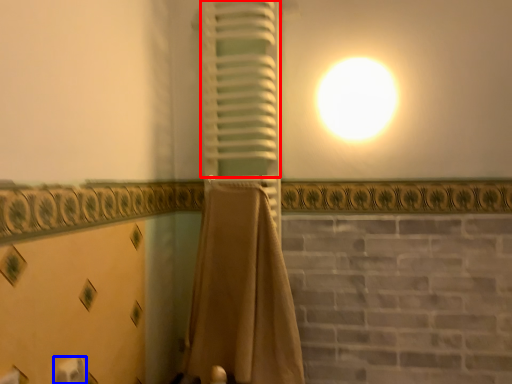
Question: Among these objects, which one is nearest to the camera, curtain (highlighted by a red box) or toilet paper (highlighted by a blue box)?

Choices:
 (A) curtain
 (B) toilet paper

Answer: (B)